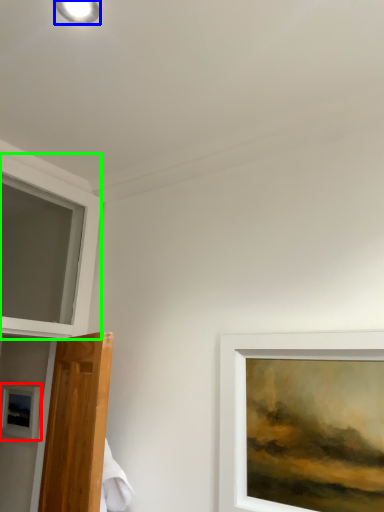
Question: Which object is the farthest from picture frame (highlighted by a red box)? Choose among these: droplight (highlighted by a blue box) or window (highlighted by a green box).

Choices:
 (A) droplight
 (B) window

Answer: (A)